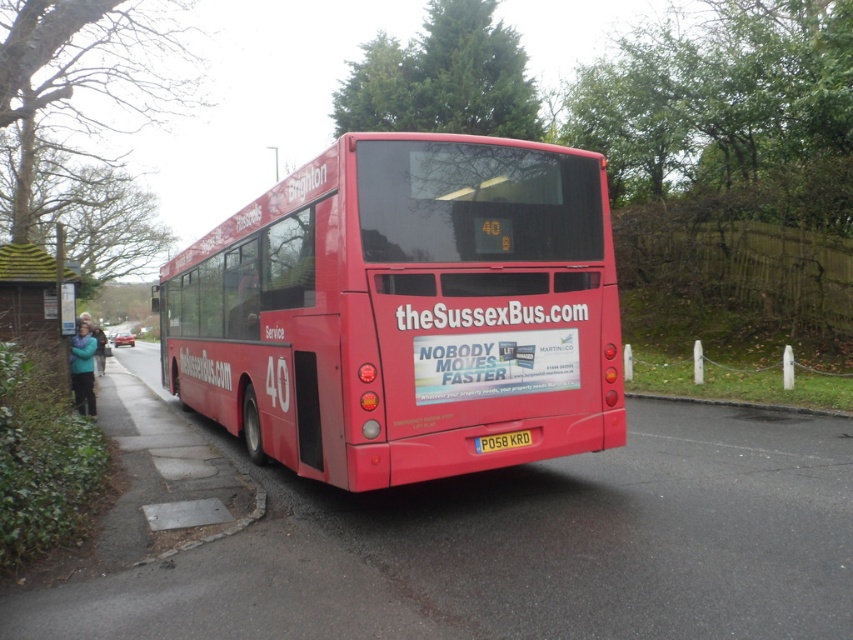
Question: Among these points, which one is nearest to the camera?

Choices:
 (A) (482, 444)
 (B) (61, 285)
 (C) (413, 406)

Answer: (C)

Question: Is wooden thatched roof at left smaller than yellow plastic license plate at center?

Choices:
 (A) no
 (B) yes

Answer: (A)

Question: Among these points, which one is farthest from the camera?

Choices:
 (A) (521, 436)
 (B) (36, 276)

Answer: (B)

Question: Is matte red bus at center bigger than yellow plastic license plate at center?

Choices:
 (A) yes
 (B) no

Answer: (A)

Question: Which object appears farthest from the camera in this image?

Choices:
 (A) matte red bus at center
 (B) wooden thatched roof at left

Answer: (B)

Question: Can you confirm if wooden thatched roof at left is positioned above yellow plastic license plate at center?

Choices:
 (A) no
 (B) yes

Answer: (B)